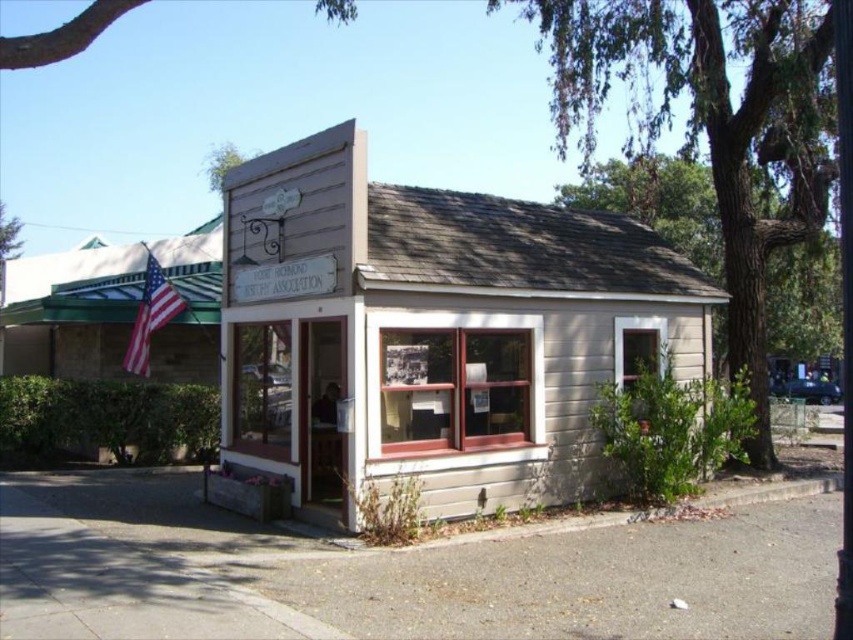
Between wooden signboard at center and matte american flag at left, which one has more height?

With more height is matte american flag at left.

Based on the photo, is wooden signboard at center taller than matte american flag at left?

No, wooden signboard at center is not taller than matte american flag at left.

Identify the location of wooden signboard at center. coord(431,332).

Find the location of a particular element. The image size is (853, 640). wooden signboard at center is located at coordinates (431, 332).